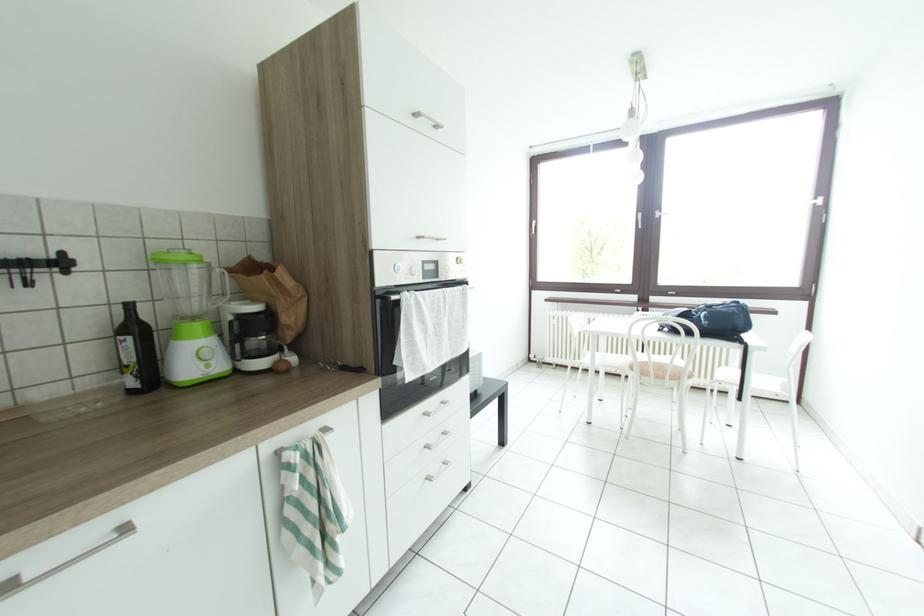
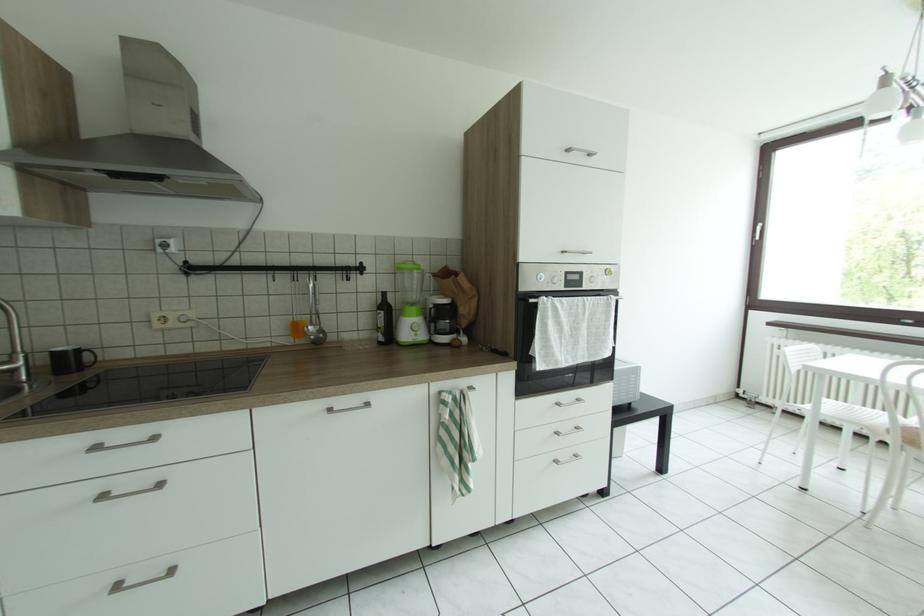
Question: How did the camera likely rotate?

Choices:
 (A) Left
 (B) Right
 (C) Up
 (D) Down

Answer: (A)